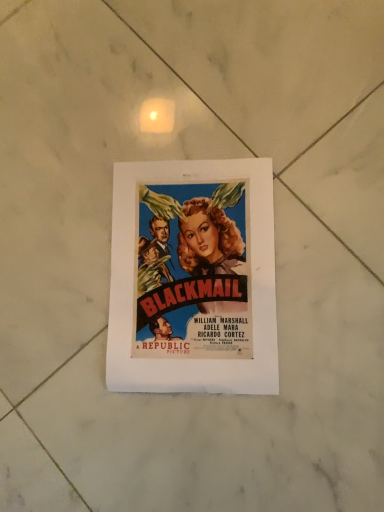
Image resolution: width=384 pixels, height=512 pixels. I want to click on free point below matte paper poster at center (from a real-world perspective), so click(195, 274).